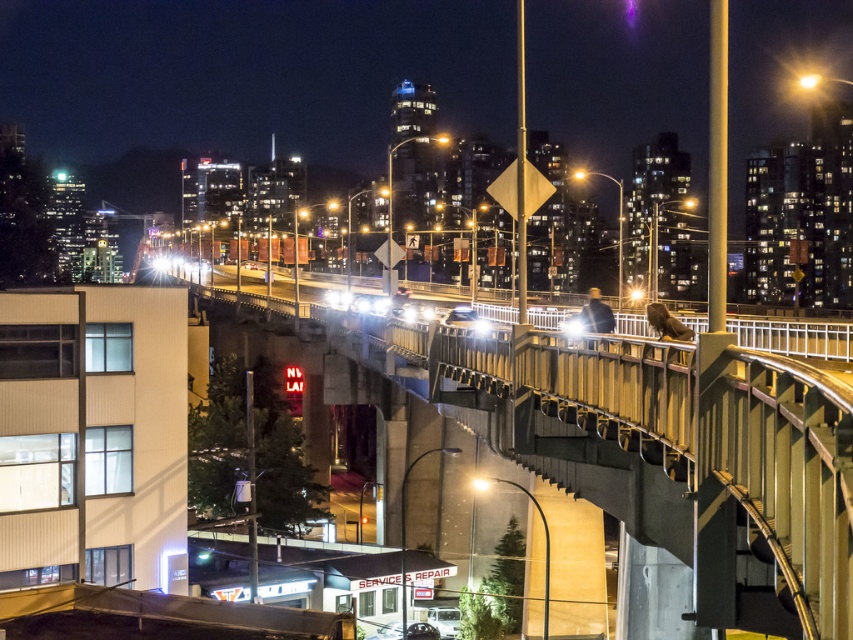
Question: Which point is farther from the camera taking this photo?

Choices:
 (A) (573, 355)
 (B) (200, 268)

Answer: (B)

Question: Among these points, which one is nearest to the camera?

Choices:
 (A) click(x=712, y=448)
 (B) click(x=772, y=321)

Answer: (A)

Question: Which point appears farthest from the camera in this image?

Choices:
 (A) (808, 336)
 (B) (552, 346)

Answer: (A)

Question: Does concrete bridge at center have a greater width compared to metallic gray bridge at center?

Choices:
 (A) yes
 (B) no

Answer: (B)

Question: Where is concrete bridge at center located in relation to metallic gray bridge at center in the image?

Choices:
 (A) below
 (B) above

Answer: (A)

Question: In this image, where is concrete bridge at center located relative to metallic gray bridge at center?

Choices:
 (A) right
 (B) left

Answer: (A)